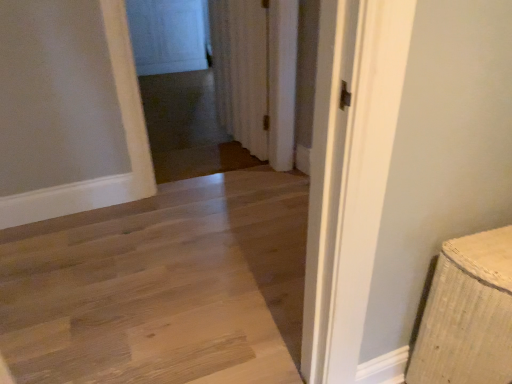
Question: Based on their positions, is natural wood floor at center located to the left or right of white textured curtain at center?

Choices:
 (A) left
 (B) right

Answer: (A)

Question: From a real-world perspective, is natural wood floor at center above or below white textured curtain at center?

Choices:
 (A) above
 (B) below

Answer: (B)

Question: Which is nearer to the transparent glass screen door at upper center?

Choices:
 (A) natural wood floor at center
 (B) white textured curtain at center

Answer: (B)

Question: Estimate the real-world distances between objects in this image. Which object is closer to the natural wood floor at center?

Choices:
 (A) transparent glass screen door at upper center
 (B) white textured curtain at center

Answer: (B)